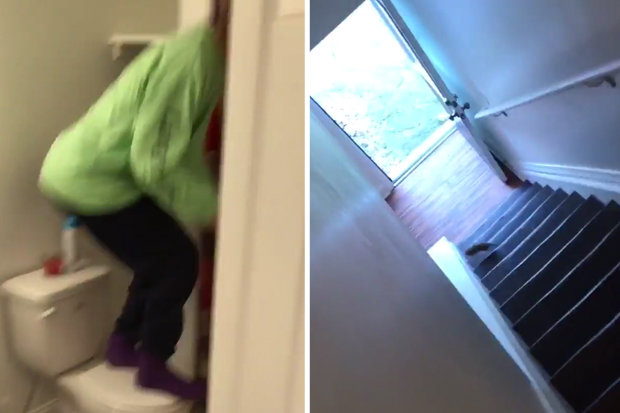
I want to click on toilet, so click(x=115, y=384).